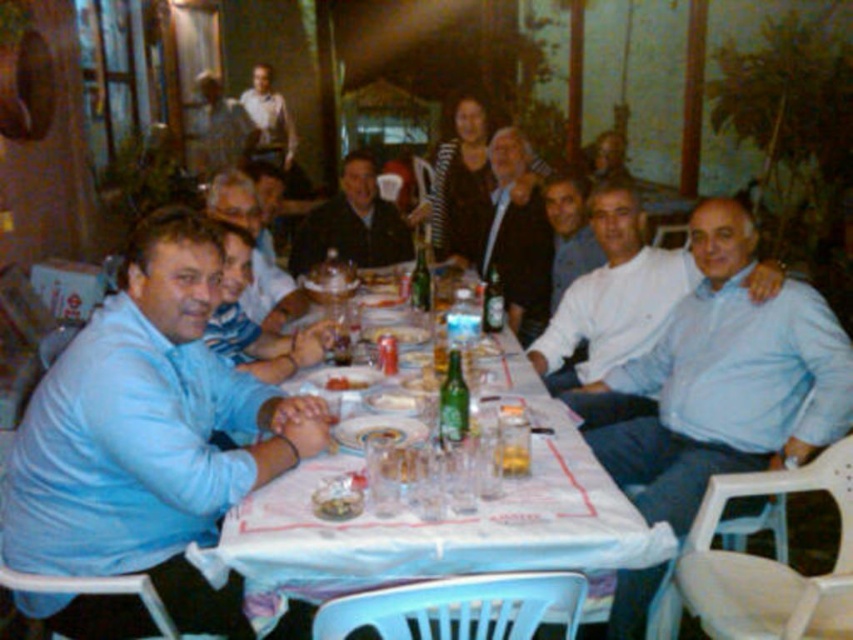
Question: Which object appears closest to the camera in this image?

Choices:
 (A) dark blue shirt at center
 (B) clear glass water at center
 (C) blue shirt at left

Answer: (B)

Question: Which of the following is the farthest from the observer?

Choices:
 (A) (463, 259)
 (B) (216, 202)
 (C) (265, 100)

Answer: (C)

Question: Considering the real-world distances, which object is closest to the dark blue shirt at center?

Choices:
 (A) light blue shirt at right
 (B) white glossy plate at table center
 (C) white plastic table at center
 (D) light blue shirt at left

Answer: (B)

Question: Is striped fabric shirt at center positioned at the back of dark blue shirt at center?

Choices:
 (A) yes
 (B) no

Answer: (B)

Question: Is light blue shirt at right positioned at the back of clear glass water at center?

Choices:
 (A) yes
 (B) no

Answer: (A)

Question: Is light blue shirt at left above dark blue shirt at center?

Choices:
 (A) no
 (B) yes

Answer: (A)